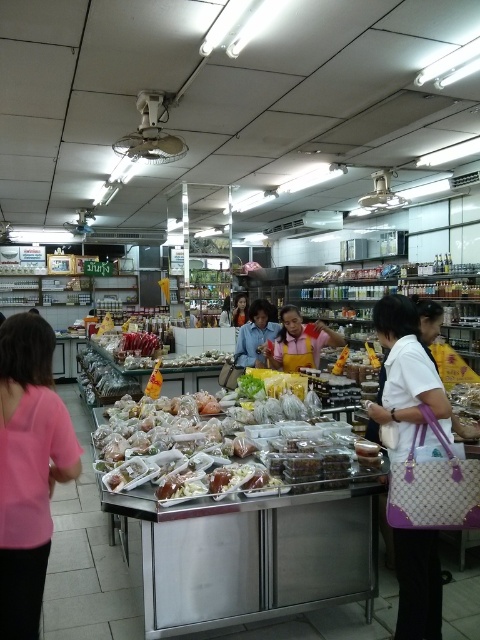
Which is more to the right, yellow fabric apron at center or yellow fabric shirt at center?

yellow fabric apron at center

Does point (312, 340) come closer to viewer compared to point (237, 305)?

That is True.

Describe the element at coordinates (299, 342) in the screenshot. I see `yellow fabric apron at center` at that location.

The image size is (480, 640). Find the location of `yellow fabric apron at center`. yellow fabric apron at center is located at coordinates (299, 342).

Can you confirm if white fabric handbag at center-right is positioned to the right of yellow fabric apron at center?

Indeed, white fabric handbag at center-right is positioned on the right side of yellow fabric apron at center.

Does white fabric handbag at center-right have a larger size compared to yellow fabric apron at center?

No, white fabric handbag at center-right is not bigger than yellow fabric apron at center.

Where is `white fabric handbag at center-right`? white fabric handbag at center-right is located at coordinates (405, 372).

How much distance is there between translucent plastic containers at center and yellow fabric shirt at center?

A distance of 5.57 meters exists between translucent plastic containers at center and yellow fabric shirt at center.

Which is in front, point (240, 465) or point (240, 305)?

Point (240, 465) is more forward.

I want to click on translucent plastic containers at center, so click(226, 445).